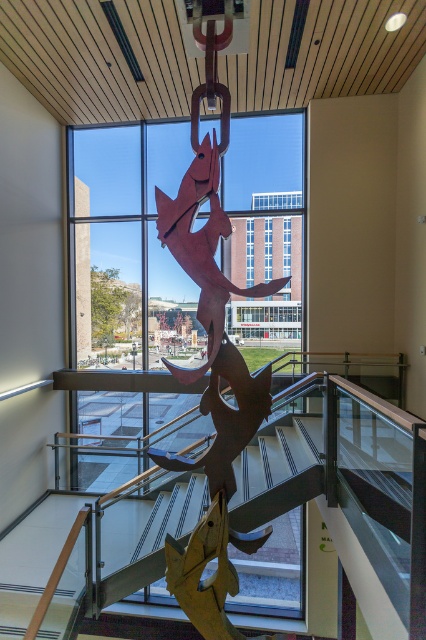
You are a delivery person carrying a package that is 4 meters long. You need to move it through the space between the wooden fish at center and the metallic staircase at center. Can you safely maneuver the package through that space?

The distance between the wooden fish at center and the metallic staircase at center is 4.13 meters, which is slightly longer than the 4 meter package. Therefore, you can safely maneuver the package through the space between them.

You are an interior designer planning to place a new piece of furniture in the space. The wooden fish at center and the metallic staircase at center are already present. Which object would require more space if you were to move them both to a new location?

The metallic staircase at center requires more space because it is larger than the wooden fish at center.